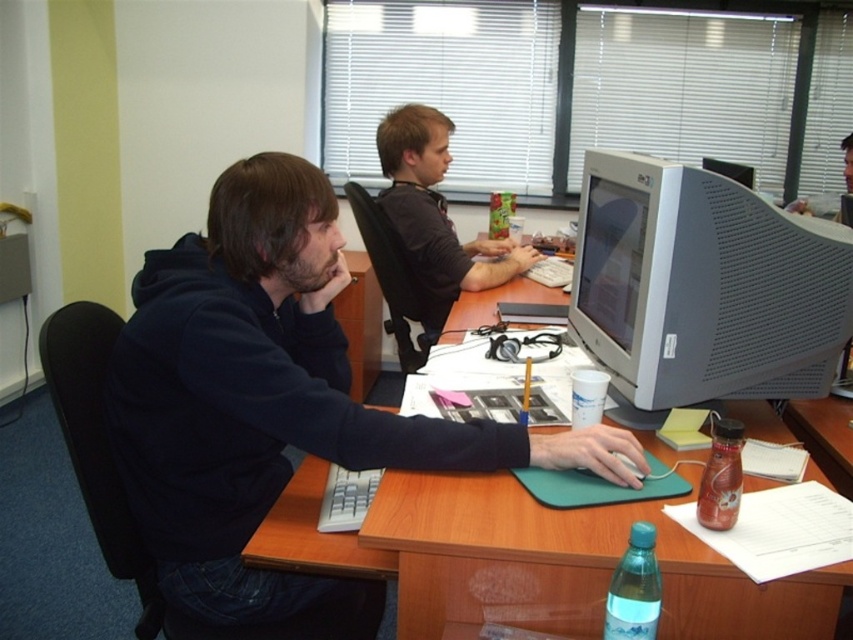
You are a delivery person who needs to deliver a package to the person wearing the dark blue hoodie at center and the matte black shirt at center. Which one is closer to the left side of the desk?

The dark blue hoodie at center is to the left of the matte black shirt at center, so the dark blue hoodie at center is closer to the left side of the desk.

You are a delivery robot with a package that needs to be placed on the desk near the dark blue hoodie at center. The robot requires at least 0.5 meters of space to maneuver around objects. Can you safely approach the desk to deliver the package?

The dark blue hoodie at center is 1.11 meters away from the viewer. Since the robot needs 0.5 meters to maneuver, it can safely approach the desk as the distance is sufficient for delivery.

You are a delivery person entering an office and need to place a package on the desk. The package must be placed closer to the dark blue hoodie at center than to the gray plastic monitor at right. Where should you place the package?

The dark blue hoodie at center is closer to the viewer than the gray plastic monitor at right, so place the package near the dark blue hoodie at center to ensure it is closer to it than the monitor.